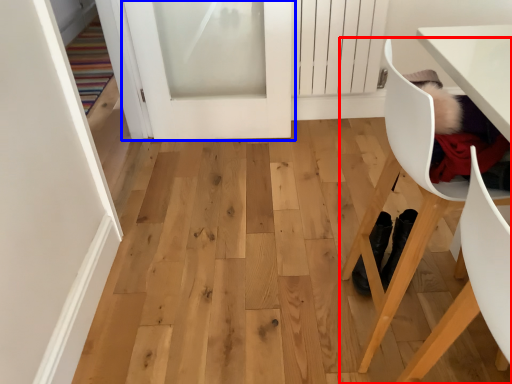
Question: Which object is further to the camera taking this photo, chair (highlighted by a red box) or door (highlighted by a blue box)?

Choices:
 (A) chair
 (B) door

Answer: (B)